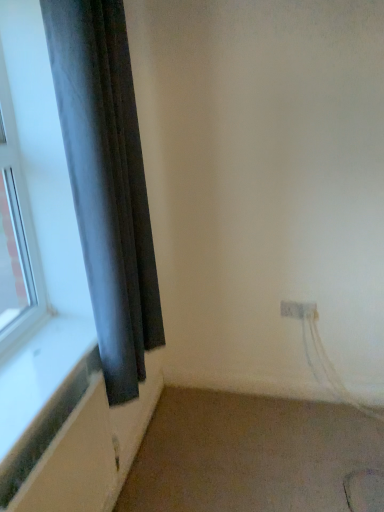
Question: Considering the positions of point (102, 260) and point (283, 309), is point (102, 260) closer or farther from the camera than point (283, 309)?

Choices:
 (A) closer
 (B) farther

Answer: (A)

Question: Relative to white plastic electric outlet at lower right, is dark gray fabric curtain at left in front or behind?

Choices:
 (A) front
 (B) behind

Answer: (A)

Question: Based on their relative distances, which object is farther from the dark gray fabric curtain at left?

Choices:
 (A) beige carpet at lower right
 (B) white plastic electric outlet at lower right

Answer: (B)

Question: Considering the real-world distances, which object is farthest from the beige carpet at lower right?

Choices:
 (A) white plastic electric outlet at lower right
 (B) dark gray fabric curtain at left

Answer: (B)